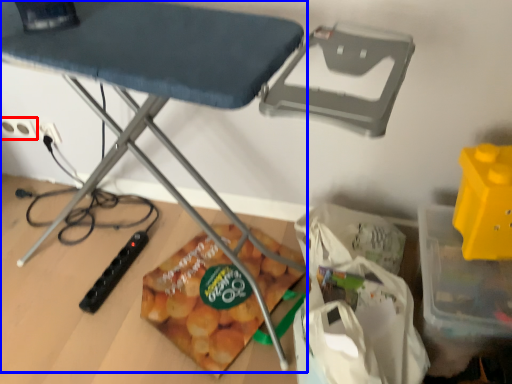
Question: Among these objects, which one is farthest to the camera, electric outlet (highlighted by a red box) or table (highlighted by a blue box)?

Choices:
 (A) electric outlet
 (B) table

Answer: (A)